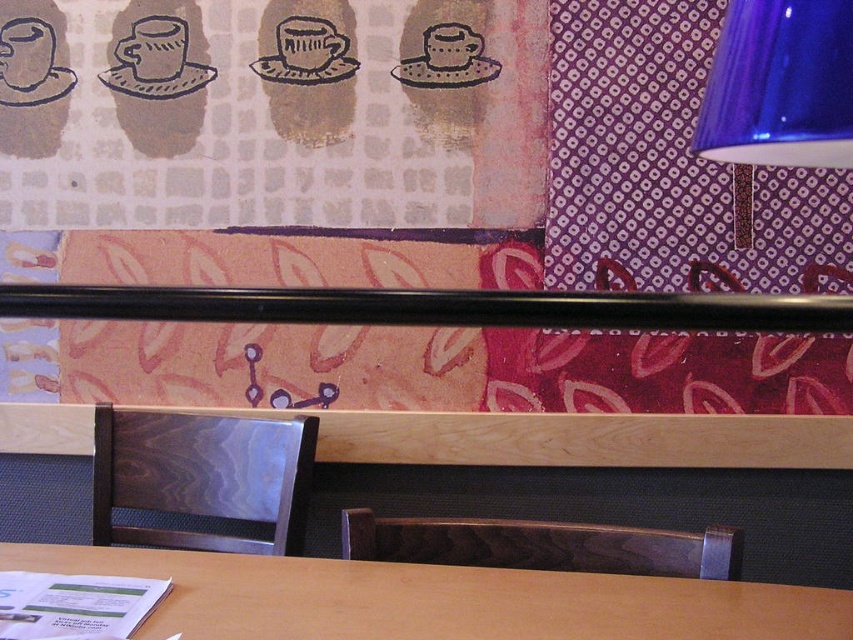
How far apart are wooden table at center and dark wood/marble chair at lower center?

wooden table at center and dark wood/marble chair at lower center are 10.10 centimeters apart from each other.

You are a GUI agent. You are given a task and a screenshot of the screen. Output one action in this format:
    pyautogui.click(x=<x>, y=<y>)
    Task: Click on the wooden table at center
    The height and width of the screenshot is (640, 853).
    Given the screenshot: What is the action you would take?
    pyautogui.click(x=439, y=600)

Where is `wooden table at center`? The image size is (853, 640). wooden table at center is located at coordinates (439, 600).

Does wooden table at center have a lesser width compared to wooden chair at lower center?

In fact, wooden table at center might be wider than wooden chair at lower center.

Is wooden table at center above wooden chair at lower center?

No, wooden table at center is not above wooden chair at lower center.

You are a GUI agent. You are given a task and a screenshot of the screen. Output one action in this format:
    pyautogui.click(x=<x>, y=<y>)
    Task: Click on the wooden table at center
    This screenshot has height=640, width=853.
    Given the screenshot: What is the action you would take?
    pyautogui.click(x=439, y=600)

Locate an element on the screen. This screenshot has width=853, height=640. wooden table at center is located at coordinates (439, 600).

Who is positioned more to the left, wooden chair at lower center or blue glass lampshade at upper right?

wooden chair at lower center

Is wooden chair at lower center wider than blue glass lampshade at upper right?

Indeed, wooden chair at lower center has a greater width compared to blue glass lampshade at upper right.

What do you see at coordinates (201, 476) in the screenshot? I see `wooden chair at lower center` at bounding box center [201, 476].

The image size is (853, 640). In order to click on wooden chair at lower center in this screenshot , I will do `click(201, 476)`.